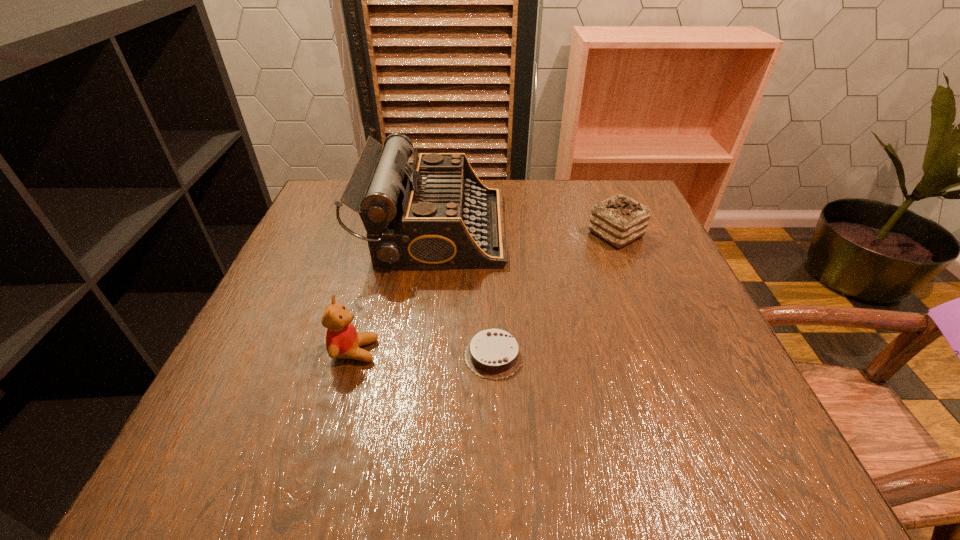
This screenshot has width=960, height=540. Find the location of `vacant region that satisfies the following two spatial constraints: 1. on the keyboard of the tallest object; 2. on the left side of the second shortest object`. vacant region that satisfies the following two spatial constraints: 1. on the keyboard of the tallest object; 2. on the left side of the second shortest object is located at coordinates (434, 234).

Where is `free point that satisfies the following two spatial constraints: 1. on the front side of the rightmost object; 2. on the front-facing side of the teddy bear`? free point that satisfies the following two spatial constraints: 1. on the front side of the rightmost object; 2. on the front-facing side of the teddy bear is located at coordinates (662, 351).

Where is `vacant region that satisfies the following two spatial constraints: 1. on the keyboard of the left chocolate cake; 2. on the right side of the tallest object`? vacant region that satisfies the following two spatial constraints: 1. on the keyboard of the left chocolate cake; 2. on the right side of the tallest object is located at coordinates (419, 355).

Image resolution: width=960 pixels, height=540 pixels. In order to click on vacant area in the image that satisfies the following two spatial constraints: 1. on the keyboard of the right chocolate cake; 2. on the left side of the tallest object in this screenshot , I will do `click(434, 234)`.